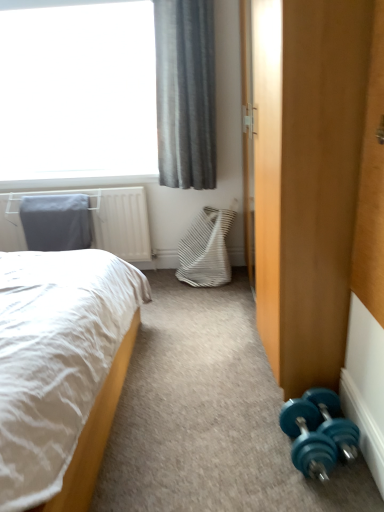
Measure the distance between teal rubber dumbbell at lower right, arranged as the first dumbbell when viewed from the right, and camera.

teal rubber dumbbell at lower right, arranged as the first dumbbell when viewed from the right, and camera are 1.32 meters apart from each other.

What do you see at coordinates (308, 439) in the screenshot? The image size is (384, 512). I see `teal rubber dumbbell at lower right, which ranks as the 1th dumbbell in left-to-right order` at bounding box center [308, 439].

Describe the element at coordinates (206, 249) in the screenshot. I see `white woven swivel chair at center` at that location.

This screenshot has height=512, width=384. Describe the element at coordinates (185, 93) in the screenshot. I see `gray fabric curtain at upper left` at that location.

Image resolution: width=384 pixels, height=512 pixels. What are the coordinates of `wooden wardrobe at lower right` in the screenshot? It's located at (307, 179).

What is the approximate height of wooden wardrobe at lower right?

wooden wardrobe at lower right is 5.60 feet tall.

What is the approximate height of gray fabric pillow at upper left?

The height of gray fabric pillow at upper left is 16.49 inches.

This screenshot has height=512, width=384. Find the location of `teal rubber dumbbell at lower right, which appears as the second dumbbell when viewed from the left`. teal rubber dumbbell at lower right, which appears as the second dumbbell when viewed from the left is located at coordinates (335, 422).

From the image's perspective, is gray fabric pillow at upper left under gray fabric curtain at upper left?

Yes.

Considering the sizes of objects gray fabric pillow at upper left and gray fabric curtain at upper left in the image provided, who is thinner, gray fabric pillow at upper left or gray fabric curtain at upper left?

With smaller width is gray fabric pillow at upper left.

Locate an element on the screen. pillow below the gray fabric curtain at upper left (from a real-world perspective) is located at coordinates (56, 222).

Between gray fabric pillow at upper left and white woven swivel chair at center, which one appears on the right side from the viewer's perspective?

From the viewer's perspective, white woven swivel chair at center appears more on the right side.

Does gray fabric pillow at upper left have a larger size compared to white woven swivel chair at center?

No, gray fabric pillow at upper left is not bigger than white woven swivel chair at center.

Is gray fabric pillow at upper left behind white woven swivel chair at center?

Yes, gray fabric pillow at upper left is further from the viewer.

Is gray fabric pillow at upper left shorter than white woven swivel chair at center?

Correct, gray fabric pillow at upper left is not as tall as white woven swivel chair at center.

Does white woven swivel chair at center come in front of gray fabric curtain at upper left?

No, white woven swivel chair at center is further to the viewer.

From a real-world perspective, who is located lower, white woven swivel chair at center or gray fabric curtain at upper left?

white woven swivel chair at center.

From the image's perspective, does white woven swivel chair at center appear lower than gray fabric curtain at upper left?

Yes.

Can you confirm if teal rubber dumbbell at lower right, which ranks as the 1th dumbbell in left-to-right order, is positioned to the right of white woven swivel chair at center?

Correct, you'll find teal rubber dumbbell at lower right, which ranks as the 1th dumbbell in left-to-right order, to the right of white woven swivel chair at center.

Is teal rubber dumbbell at lower right, which ranks as the 1th dumbbell in left-to-right order, not near white woven swivel chair at center?

Yes, teal rubber dumbbell at lower right, which ranks as the 1th dumbbell in left-to-right order, and white woven swivel chair at center are quite far apart.

Consider the image. Considering the relative sizes of teal rubber dumbbell at lower right, the second dumbbell positioned from the right, and white woven swivel chair at center in the image provided, is teal rubber dumbbell at lower right, the second dumbbell positioned from the right, shorter than white woven swivel chair at center?

Yes, teal rubber dumbbell at lower right, the second dumbbell positioned from the right, is shorter than white woven swivel chair at center.

Considering the points (307, 475) and (227, 221), which point is in front, point (307, 475) or point (227, 221)?

Point (307, 475)

Can teal rubber dumbbell at lower right, which ranks as the 1th dumbbell in left-to-right order, be found inside gray fabric pillow at upper left?

Actually, teal rubber dumbbell at lower right, which ranks as the 1th dumbbell in left-to-right order, is outside gray fabric pillow at upper left.

Can you confirm if gray fabric pillow at upper left is wider than teal rubber dumbbell at lower right, which ranks as the 1th dumbbell in left-to-right order?

Indeed, gray fabric pillow at upper left has a greater width compared to teal rubber dumbbell at lower right, which ranks as the 1th dumbbell in left-to-right order.

Is gray fabric pillow at upper left looking in the opposite direction of teal rubber dumbbell at lower right, which ranks as the 1th dumbbell in left-to-right order?

gray fabric pillow at upper left is not turned away from teal rubber dumbbell at lower right, which ranks as the 1th dumbbell in left-to-right order.

Which dumbbell is the 1st one when counting from the right side of the gray fabric pillow at upper left? Please provide its 2D coordinates.

[(308, 439)]

Is wooden wardrobe at lower right further to camera compared to white soft bed at left?

Yes, it is behind white soft bed at left.

From the image's perspective, does wooden wardrobe at lower right appear higher than white soft bed at left?

Yes, from the image's perspective, wooden wardrobe at lower right is on top of white soft bed at left.

Is white soft bed at left inside wooden wardrobe at lower right?

That's incorrect, white soft bed at left is not inside wooden wardrobe at lower right.

Where is `armoire to the right of white soft bed at left`? Image resolution: width=384 pixels, height=512 pixels. armoire to the right of white soft bed at left is located at coordinates (307, 179).

Is teal rubber dumbbell at lower right, which appears as the second dumbbell when viewed from the left, turned away from gray fabric curtain at upper left?

teal rubber dumbbell at lower right, which appears as the second dumbbell when viewed from the left, is not turned away from gray fabric curtain at upper left.

Is teal rubber dumbbell at lower right, arranged as the first dumbbell when viewed from the right, taller or shorter than gray fabric curtain at upper left?

Considering their sizes, teal rubber dumbbell at lower right, arranged as the first dumbbell when viewed from the right, has less height than gray fabric curtain at upper left.

The height and width of the screenshot is (512, 384). I want to click on the 1st dumbbell below when counting from the gray fabric curtain at upper left (from the image's perspective), so click(x=335, y=422).

Which object is wider, teal rubber dumbbell at lower right, arranged as the first dumbbell when viewed from the right, or gray fabric curtain at upper left?

Wider between the two is gray fabric curtain at upper left.

Identify the location of curtain in front of the gray fabric pillow at upper left. This screenshot has width=384, height=512. (185, 93).

At what (x,y) coordinates should I click in order to perform the action: click on pillow lying on the left of white woven swivel chair at center. Please return your answer as a coordinate pair (x, y). Image resolution: width=384 pixels, height=512 pixels. Looking at the image, I should click on click(56, 222).

Which object lies further to the anchor point wooden wardrobe at lower right, gray fabric pillow at upper left or white woven swivel chair at center?

The object further to wooden wardrobe at lower right is gray fabric pillow at upper left.

Which object lies nearer to the anchor point wooden wardrobe at lower right, white woven swivel chair at center or gray fabric pillow at upper left?

white woven swivel chair at center is closer to wooden wardrobe at lower right.

Looking at the image, which one is located further to white woven swivel chair at center, wooden wardrobe at lower right or white soft bed at left?

wooden wardrobe at lower right lies further to white woven swivel chair at center than the other object.

Based on the photo, looking at the image, which one is located closer to white soft bed at left, wooden wardrobe at lower right or white woven swivel chair at center?

The object closer to white soft bed at left is wooden wardrobe at lower right.

Considering their positions, is gray fabric pillow at upper left positioned closer to white soft bed at left than wooden wardrobe at lower right?

wooden wardrobe at lower right lies closer to white soft bed at left than the other object.

Considering their positions, is gray fabric curtain at upper left positioned closer to wooden wardrobe at lower right than white woven swivel chair at center?

gray fabric curtain at upper left is positioned closer to the anchor wooden wardrobe at lower right.

Which object lies further to the anchor point teal rubber dumbbell at lower right, which ranks as the 1th dumbbell in left-to-right order, gray fabric pillow at upper left or white woven swivel chair at center?

The object further to teal rubber dumbbell at lower right, which ranks as the 1th dumbbell in left-to-right order, is gray fabric pillow at upper left.

Considering their positions, is wooden wardrobe at lower right positioned closer to teal rubber dumbbell at lower right, the second dumbbell positioned from the right, than white woven swivel chair at center?

wooden wardrobe at lower right is closer to teal rubber dumbbell at lower right, the second dumbbell positioned from the right.

Where is `armoire that lies between gray fabric curtain at upper left and teal rubber dumbbell at lower right, the second dumbbell positioned from the right, from top to bottom`? This screenshot has height=512, width=384. armoire that lies between gray fabric curtain at upper left and teal rubber dumbbell at lower right, the second dumbbell positioned from the right, from top to bottom is located at coordinates (307, 179).

The height and width of the screenshot is (512, 384). Identify the location of swivel chair between wooden wardrobe at lower right and gray fabric pillow at upper left along the z-axis. (206, 249).

You are a GUI agent. You are given a task and a screenshot of the screen. Output one action in this format:
    pyautogui.click(x=<x>, y=<y>)
    Task: Click on the swivel chair between gray fabric curtain at upper left and teal rubber dumbbell at lower right, which ranks as the 1th dumbbell in left-to-right order, from top to bottom
    
    Given the screenshot: What is the action you would take?
    pyautogui.click(x=206, y=249)

The height and width of the screenshot is (512, 384). Identify the location of curtain between gray fabric pillow at upper left and white woven swivel chair at center from left to right. pos(185,93).